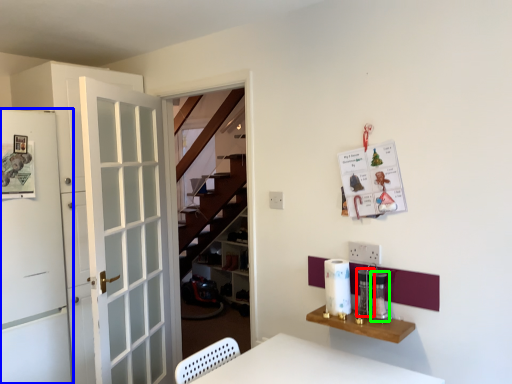
Question: Which is nearer to the appliance (highlighted by a red box)? door (highlighted by a blue box) or appliance (highlighted by a green box).

Choices:
 (A) door
 (B) appliance

Answer: (B)